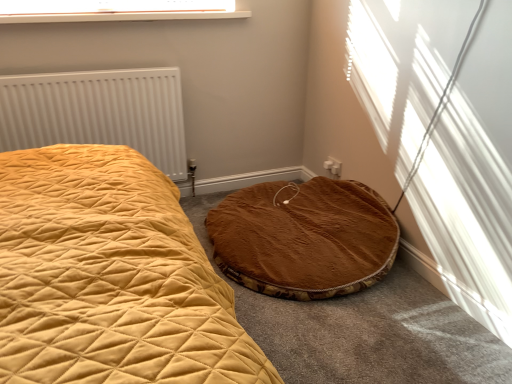
Identify the location of brown plush cat bed at lower right. The width and height of the screenshot is (512, 384). (304, 238).

In order to click on clear plastic window screen at upper center in this screenshot , I will do `click(111, 6)`.

What are the coordinates of `radiator on the left of brown plush cat bed at lower right` in the screenshot? It's located at (98, 113).

How different are the orientations of brown plush cat bed at lower right and white textured radiator at left in degrees?

The angle between the facing direction of brown plush cat bed at lower right and the facing direction of white textured radiator at left is 90 degrees.

Who is bigger, brown plush cat bed at lower right or white textured radiator at left?

brown plush cat bed at lower right is bigger.

Does point (215, 241) lie behind point (157, 119)?

No, it is not.

Is clear plastic window screen at upper center aimed at white textured radiator at left?

No, clear plastic window screen at upper center is not aimed at white textured radiator at left.

Does clear plastic window screen at upper center have a greater width compared to white textured radiator at left?

Correct, the width of clear plastic window screen at upper center exceeds that of white textured radiator at left.

Do you think clear plastic window screen at upper center is within white textured radiator at left, or outside of it?

clear plastic window screen at upper center lies outside white textured radiator at left.

Which object is further away from the camera taking this photo, clear plastic window screen at upper center or white textured radiator at left?

white textured radiator at left is more distant.

Is brown plush cat bed at lower right bigger or smaller than clear plastic window screen at upper center?

Considering their sizes, brown plush cat bed at lower right takes up more space than clear plastic window screen at upper center.

From the image's perspective, is brown plush cat bed at lower right above or below clear plastic window screen at upper center?

Clearly, from the image's perspective, brown plush cat bed at lower right is below clear plastic window screen at upper center.

From a real-world perspective, which object rests below the other?

brown plush cat bed at lower right is physically lower.

Is brown plush cat bed at lower right next to clear plastic window screen at upper center and touching it?

brown plush cat bed at lower right is not next to clear plastic window screen at upper center, and they're not touching.

From the image's perspective, who appears lower, white textured radiator at left or clear plastic window screen at upper center?

white textured radiator at left appears lower in the image.

Looking at this image, is white textured radiator at left in contact with clear plastic window screen at upper center?

No.

Based on their sizes in the image, would you say white textured radiator at left is bigger or smaller than clear plastic window screen at upper center?

white textured radiator at left is bigger than clear plastic window screen at upper center.

How different are the orientations of white textured radiator at left and clear plastic window screen at upper center in degrees?

There is a 0.151-degree angle between the facing directions of white textured radiator at left and clear plastic window screen at upper center.

Considering the relative sizes of white textured radiator at left and brown plush cat bed at lower right in the image provided, is white textured radiator at left wider than brown plush cat bed at lower right?

No, white textured radiator at left is not wider than brown plush cat bed at lower right.

How much distance is there between white textured radiator at left and brown plush cat bed at lower right?

white textured radiator at left is 36.10 inches from brown plush cat bed at lower right.

Is white textured radiator at left positioned far away from brown plush cat bed at lower right?

white textured radiator at left is near brown plush cat bed at lower right, not far away.

Between white textured radiator at left and brown plush cat bed at lower right, which one has larger size?

With larger size is brown plush cat bed at lower right.

Is clear plastic window screen at upper center taller than brown plush cat bed at lower right?

No.

Consider the image. Is clear plastic window screen at upper center next to brown plush cat bed at lower right?

clear plastic window screen at upper center and brown plush cat bed at lower right are clearly separated.

Find the location of a particular element. The width and height of the screenshot is (512, 384). radiator that appears above the brown plush cat bed at lower right (from a real-world perspective) is located at coordinates (98, 113).

Identify the location of radiator on the left of clear plastic window screen at upper center. The height and width of the screenshot is (384, 512). (98, 113).

Based on their spatial positions, is clear plastic window screen at upper center or white textured radiator at left further from brown plush cat bed at lower right?

The object further to brown plush cat bed at lower right is clear plastic window screen at upper center.

When comparing their distances from clear plastic window screen at upper center, does white textured radiator at left or brown plush cat bed at lower right seem closer?

white textured radiator at left is closer to clear plastic window screen at upper center.

Based on their spatial positions, is white textured radiator at left or clear plastic window screen at upper center further from brown plush cat bed at lower right?

clear plastic window screen at upper center lies further to brown plush cat bed at lower right than the other object.

Based on their spatial positions, is brown plush cat bed at lower right or white textured radiator at left closer to clear plastic window screen at upper center?

Among the two, white textured radiator at left is located nearer to clear plastic window screen at upper center.

Based on their spatial positions, is clear plastic window screen at upper center or brown plush cat bed at lower right further from white textured radiator at left?

Based on the image, brown plush cat bed at lower right appears to be further to white textured radiator at left.

When comparing their distances from white textured radiator at left, does brown plush cat bed at lower right or clear plastic window screen at upper center seem closer?

clear plastic window screen at upper center is closer to white textured radiator at left.

I want to click on window screen between white textured radiator at left and brown plush cat bed at lower right in the horizontal direction, so click(111, 6).